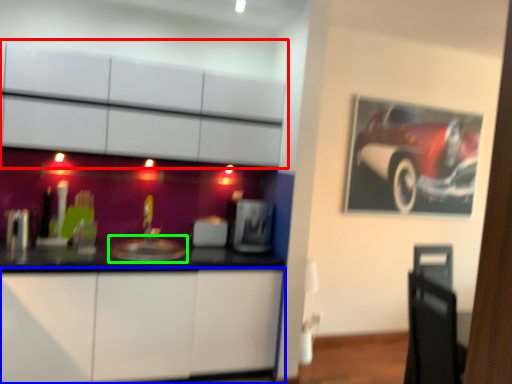
Question: Which object is the farthest from cabinetry (highlighted by a red box)? Choose among these: cabinetry (highlighted by a blue box) or sink (highlighted by a green box).

Choices:
 (A) cabinetry
 (B) sink

Answer: (A)